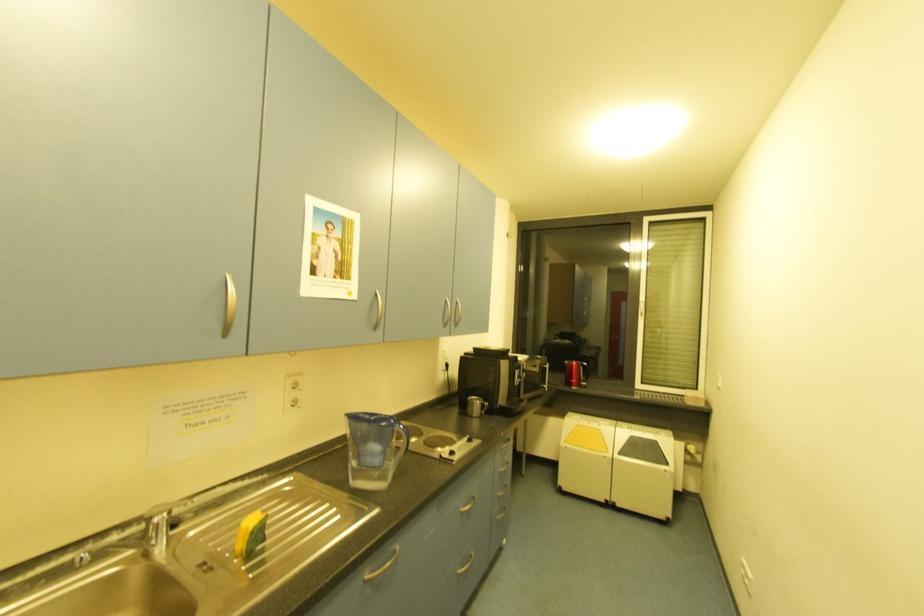
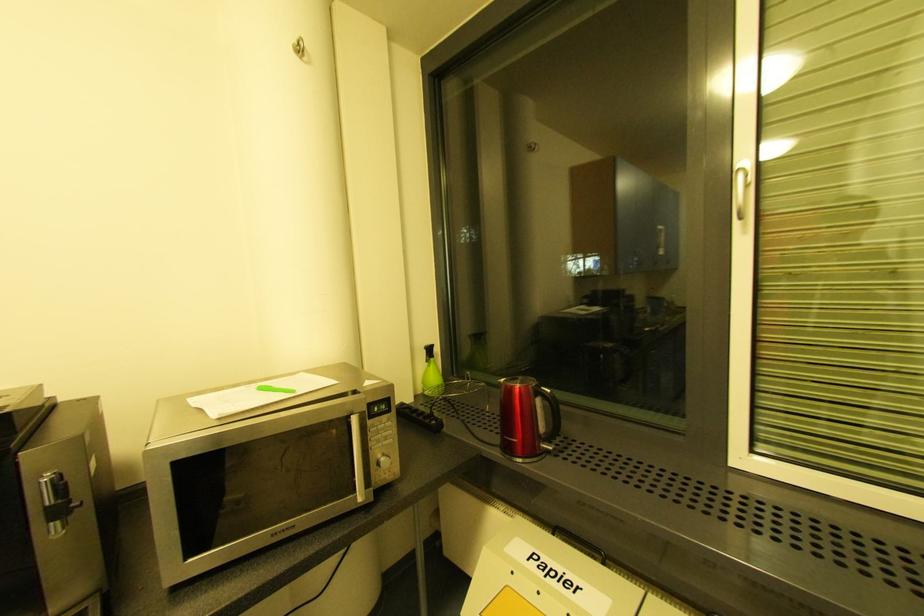
In a continuous first-person perspective shot, in which direction is the camera moving?

The movement direction of the cameraman is right, forward.